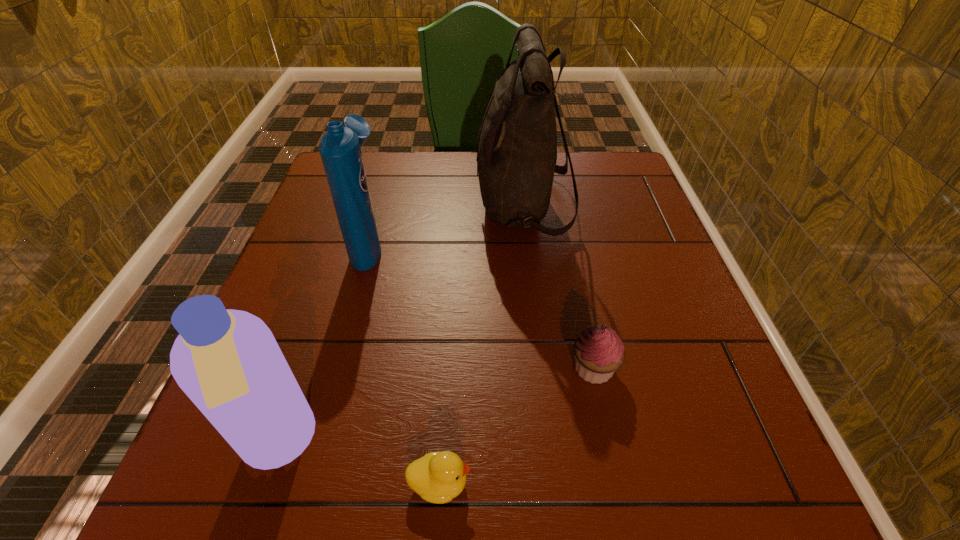
Find the location of a particular element. This screenshot has height=540, width=960. unoccupied position between the nearer shampoo and the cupcake is located at coordinates (436, 406).

At what (x,y) coordinates should I click in order to perform the action: click on unoccupied position between the shortest object and the farther shampoo. Please return your answer as a coordinate pair (x, y). The image size is (960, 540). Looking at the image, I should click on (404, 364).

Choose which object is the nearest neighbor to the nearer shampoo. Please provide its 2D coordinates. Your answer should be formatted as a tuple, i.e. [(x, y)], where the tuple contains the x and y coordinates of a point satisfying the conditions above.

[(438, 477)]

Where is `object that is the second nearest to the third farthest object`? Image resolution: width=960 pixels, height=540 pixels. object that is the second nearest to the third farthest object is located at coordinates (516, 159).

Locate an element on the screen. vacant space that satisfies the following two spatial constraints: 1. on the front side of the fourth tallest object; 2. on the right side of the farther shampoo is located at coordinates (336, 368).

Locate an element on the screen. The height and width of the screenshot is (540, 960). free point that satisfies the following two spatial constraints: 1. on the front side of the cupcake; 2. on the beak of the duckling is located at coordinates (618, 483).